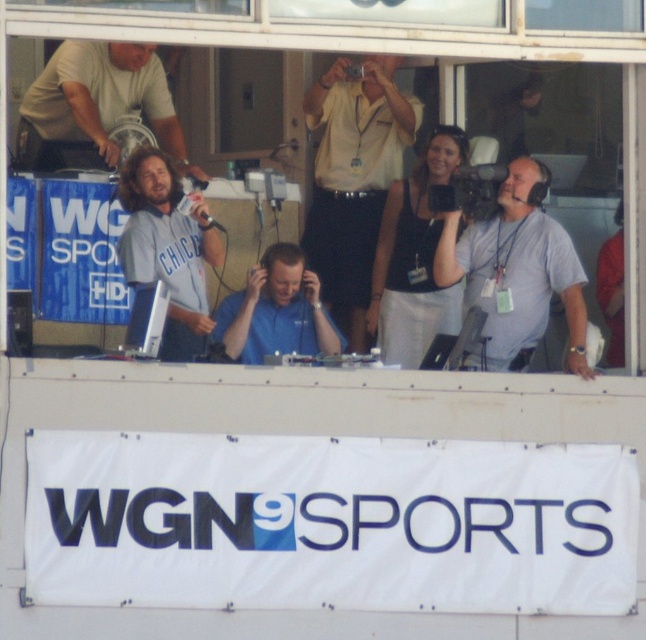
You are a photographer at the WGN 9 SPORTS booth and need to fit both the matte gray shirt at center and the blue fabric shirt at center into a single frame. Which shirt should you focus on to ensure both are visible without cropping?

The matte gray shirt at center is thinner than the blue fabric shirt at center, so focusing on the blue fabric shirt at center would allow the thinner matte gray shirt at center to fit within the frame without cropping.